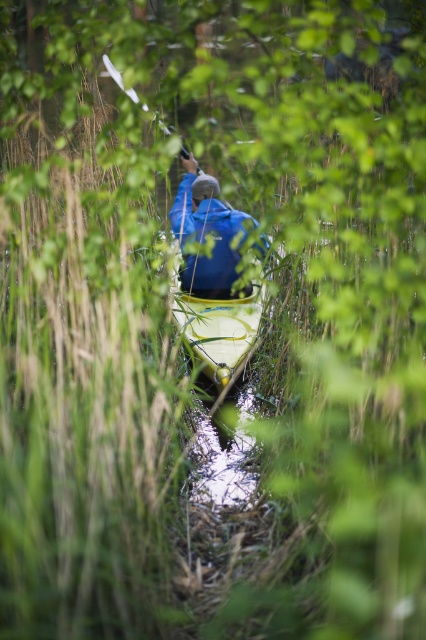
Who is lower down, blue fabric jacket at center or yellow matte kayak at center?

Positioned lower is yellow matte kayak at center.

Can you confirm if blue fabric jacket at center is positioned to the left of yellow matte kayak at center?

Correct, you'll find blue fabric jacket at center to the left of yellow matte kayak at center.

Does point (233, 280) lie behind point (192, 326)?

Yes, it is.

At what (x,y) coordinates should I click in order to perform the action: click on blue fabric jacket at center. Please return your answer as a coordinate pair (x, y). Looking at the image, I should click on (207, 234).

Does blue fabric jacket at center lie behind white plastic paddle at upper center?

Yes.

In the scene shown: Is blue fabric jacket at center wider than white plastic paddle at upper center?

Yes.

Describe the element at coordinates (207, 234) in the screenshot. I see `blue fabric jacket at center` at that location.

Where is `blue fabric jacket at center`? This screenshot has width=426, height=640. blue fabric jacket at center is located at coordinates (207, 234).

Between point (215, 358) and point (108, 67), which one is positioned behind?

Point (108, 67)

Which of these two, yellow matte kayak at center or white plastic paddle at upper center, stands shorter?

white plastic paddle at upper center is shorter.

At what (x,y) coordinates should I click in order to perform the action: click on yellow matte kayak at center. Please return your answer as a coordinate pair (x, y). This screenshot has width=426, height=640. Looking at the image, I should click on (218, 326).

Image resolution: width=426 pixels, height=640 pixels. Identify the location of yellow matte kayak at center. (218, 326).